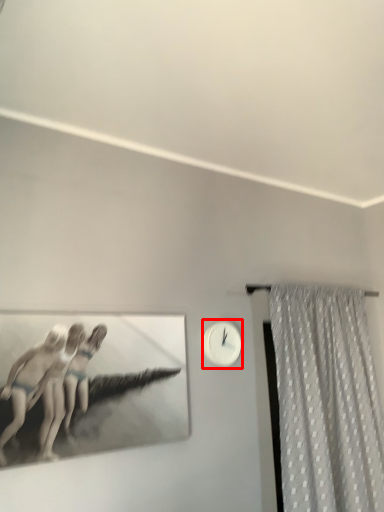
Question: From the image's perspective, where is clock (annotated by the red box) located in relation to curtain in the image?

Choices:
 (A) below
 (B) above

Answer: (B)